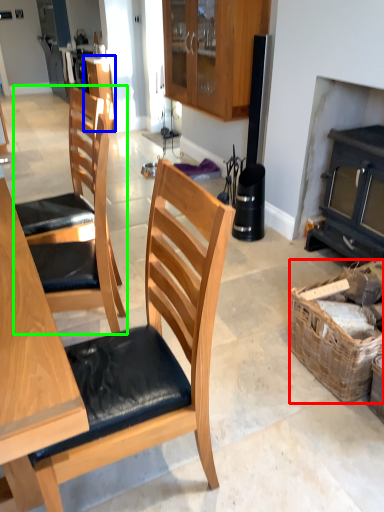
Question: Estimate the real-world distances between objects in this image. Which object is farther from picnic basket (highlighted by a red box), cabinetry (highlighted by a blue box) or chair (highlighted by a green box)?

Choices:
 (A) cabinetry
 (B) chair

Answer: (A)